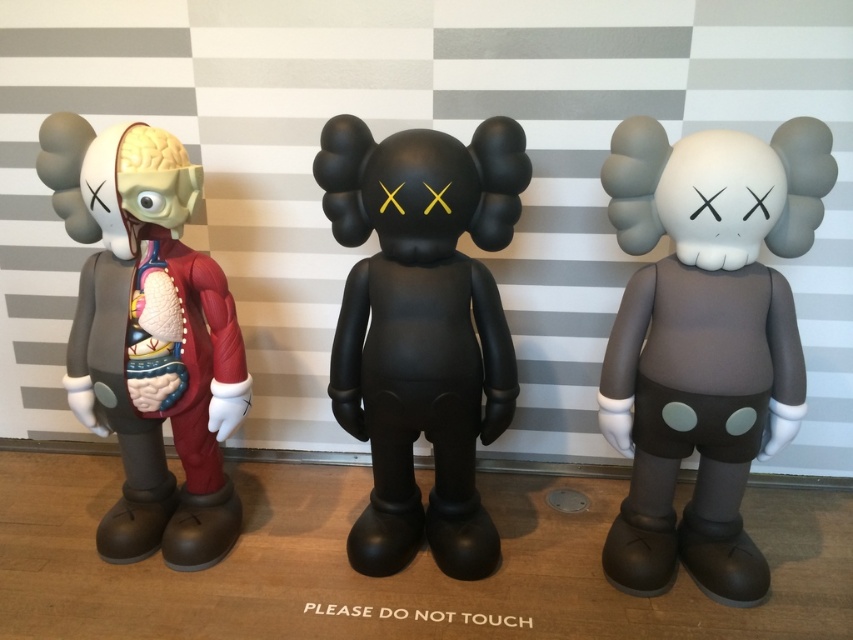
Can you confirm if matte gray figure at center is positioned below black matte/black rubber toy at center?

Yes.

The height and width of the screenshot is (640, 853). Identify the location of matte gray figure at center. (704, 340).

Who is higher up, black matte/black rubber toy at center or translucent red anatomical model at left?

Positioned higher is translucent red anatomical model at left.

Does point (347, 388) come closer to viewer compared to point (202, 444)?

Yes, it is.

Find the location of a particular element. The height and width of the screenshot is (640, 853). black matte/black rubber toy at center is located at coordinates (422, 328).

Is matte gray figure at center to the right of translucent red anatomical model at left from the viewer's perspective?

Yes, matte gray figure at center is to the right of translucent red anatomical model at left.

Between point (660, 296) and point (80, 138), which one is positioned in front?

Point (660, 296) is more forward.

Locate an element on the screen. The height and width of the screenshot is (640, 853). matte gray figure at center is located at coordinates (704, 340).